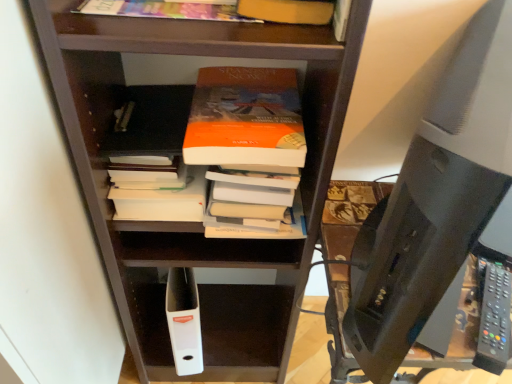
The image size is (512, 384). What do you see at coordinates (154, 121) in the screenshot?
I see `white matte book at center, which is the first book in back-to-front order` at bounding box center [154, 121].

What do you see at coordinates (180, 155) in the screenshot? I see `brown wooden shelf at center` at bounding box center [180, 155].

The image size is (512, 384). I want to click on black plastic desktop computer at right, so click(436, 198).

Is white matte book at center, which appears as the first book when ordered from the bottom, further to camera compared to brown wooden shelf at center?

Yes, the depth of white matte book at center, which appears as the first book when ordered from the bottom, is greater than that of brown wooden shelf at center.

Which is further, (129,145) or (163,247)?

The point (163,247) is farther.

From a real-world perspective, is white matte book at center, which is the first book in back-to-front order, over brown wooden shelf at center?

Yes, from a real-world perspective, white matte book at center, which is the first book in back-to-front order, is on top of brown wooden shelf at center.

From a real-world perspective, count 1st books upward from the brown wooden shelf at center and point to it. Please provide its 2D coordinates.

[(154, 121)]

Considering the points (169, 122) and (486, 368), which point is behind, point (169, 122) or point (486, 368)?

The point (169, 122) is farther from the camera.

Between brown wooden shelf at center and black plastic remote at lower right, which one has larger size?

With larger size is brown wooden shelf at center.

Measure the distance from brown wooden shelf at center to black plastic remote at lower right.

23.81 inches.

Does brown wooden shelf at center appear on the right side of black plastic remote at lower right?

No.

Which is in front, point (287, 10) or point (442, 84)?

The point (442, 84) is closer.

Considering the relative sizes of matte orange book at upper center, the second book positioned from the top, and black plastic desktop computer at right in the image provided, is matte orange book at upper center, the second book positioned from the top, shorter than black plastic desktop computer at right?

Correct, matte orange book at upper center, the second book positioned from the top, is not as tall as black plastic desktop computer at right.

Could you tell me if black plastic remote at lower right is turned towards matte orange book at upper center, which is the second book in front-to-back order?

No, black plastic remote at lower right is not turned towards matte orange book at upper center, which is the second book in front-to-back order.

From the image's perspective, is black plastic remote at lower right above or below matte orange book at upper center, which is the second book in front-to-back order?

black plastic remote at lower right is situated lower than matte orange book at upper center, which is the second book in front-to-back order, in the image.

What's the angular difference between black plastic remote at lower right and matte orange book at upper center, which appears as the second book when ordered from the bottom,'s facing directions?

They differ by 63.3 degrees in their facing directions.

From a real-world perspective, does black plastic remote at lower right sit lower than matte orange book at upper center, which appears as the second book when ordered from the bottom?

Yes, from a real-world perspective, black plastic remote at lower right is below matte orange book at upper center, which appears as the second book when ordered from the bottom.

Is multicolored paper at upper center, the first book when ordered from front to back, further to the viewer compared to black plastic desktop computer at right?

Yes, it is.

In the scene shown: Does multicolored paper at upper center, placed as the 1th book when sorted from top to bottom, turn towards black plastic desktop computer at right?

No, multicolored paper at upper center, placed as the 1th book when sorted from top to bottom, does not turn towards black plastic desktop computer at right.

From a real-world perspective, who is located higher, multicolored paper at upper center, positioned as the third book in bottom-to-top order, or black plastic desktop computer at right?

multicolored paper at upper center, positioned as the third book in bottom-to-top order.

Considering the positions of objects multicolored paper at upper center, placed as the 1th book when sorted from top to bottom, and black plastic desktop computer at right in the image provided, who is more to the right, multicolored paper at upper center, placed as the 1th book when sorted from top to bottom, or black plastic desktop computer at right?

Positioned to the right is black plastic desktop computer at right.

Is there a large distance between black plastic remote at lower right and multicolored paper at upper center, the first book when ordered from front to back?

black plastic remote at lower right is actually quite close to multicolored paper at upper center, the first book when ordered from front to back.

Identify the location of the 2nd book in front of the black plastic remote at lower right. (163, 10).

Can you confirm if black plastic remote at lower right is shorter than multicolored paper at upper center, the first book when ordered from front to back?

Correct, black plastic remote at lower right is not as tall as multicolored paper at upper center, the first book when ordered from front to back.

Is black plastic remote at lower right bigger than multicolored paper at upper center, positioned as the third book in bottom-to-top order?

No.

Considering the sizes of objects white matte book at center, which is the first book in back-to-front order, and black plastic desktop computer at right in the image provided, who is shorter, white matte book at center, which is the first book in back-to-front order, or black plastic desktop computer at right?

white matte book at center, which is the first book in back-to-front order, is shorter.

Is point (133, 121) positioned before point (393, 366)?

No, (133, 121) is behind (393, 366).

Is white matte book at center, which ranks as the third book in top-to-bottom order, smaller than black plastic desktop computer at right?

Yes, white matte book at center, which ranks as the third book in top-to-bottom order, is smaller than black plastic desktop computer at right.

From the image's perspective, between white matte book at center, which is the 3th book in front-to-back order, and black plastic desktop computer at right, who is located below?

white matte book at center, which is the 3th book in front-to-back order.

Starting from the brown wooden shelf at center, which book is the 2nd one behind? Please provide its 2D coordinates.

[(154, 121)]

The height and width of the screenshot is (384, 512). I want to click on remote below the brown wooden shelf at center (from the image's perspective), so click(x=494, y=319).

In the scene shown: Which object lies nearer to the anchor point brown wooden shelf at center, white matte book at center, which appears as the first book when ordered from the bottom, or black plastic remote at lower right?

white matte book at center, which appears as the first book when ordered from the bottom, is positioned closer to the anchor brown wooden shelf at center.

Which object lies nearer to the anchor point matte orange book at upper center, which is the second book in front-to-back order, white matte book at center, which ranks as the third book in top-to-bottom order, or black plastic remote at lower right?

Among the two, white matte book at center, which ranks as the third book in top-to-bottom order, is located nearer to matte orange book at upper center, which is the second book in front-to-back order.

Estimate the real-world distances between objects in this image. Which object is further from matte orange book at upper center, which appears as the second book when ordered from the bottom, brown wooden shelf at center or black plastic desktop computer at right?

brown wooden shelf at center lies further to matte orange book at upper center, which appears as the second book when ordered from the bottom, than the other object.

Which object lies further to the anchor point black plastic desktop computer at right, black plastic remote at lower right or brown wooden shelf at center?

The object further to black plastic desktop computer at right is brown wooden shelf at center.

Looking at the image, which one is located closer to black plastic remote at lower right, black plastic desktop computer at right or matte orange book at upper center, which is the second book in front-to-back order?

black plastic desktop computer at right is closer to black plastic remote at lower right.

From the picture: Based on their spatial positions, is multicolored paper at upper center, the first book when ordered from front to back, or white matte book at center, which is the 3th book in front-to-back order, closer to black plastic remote at lower right?

Based on the image, white matte book at center, which is the 3th book in front-to-back order, appears to be nearer to black plastic remote at lower right.

Based on their spatial positions, is matte orange book at upper center, which appears as the second book when viewed from the back, or black plastic remote at lower right further from multicolored paper at upper center, positioned as the third book in bottom-to-top order?

black plastic remote at lower right.

Considering their positions, is black plastic desktop computer at right positioned closer to brown wooden shelf at center than matte orange book at upper center, the second book positioned from the top?

black plastic desktop computer at right.

In order to click on shelf between white matte book at center, which appears as the first book when ordered from the bottom, and black plastic remote at lower right, in the horizontal direction in this screenshot , I will do `click(180, 155)`.

At what (x,y) coordinates should I click in order to perform the action: click on shelf located between black plastic desktop computer at right and white matte book at center, which appears as the first book when ordered from the bottom, in the depth direction. Please return your answer as a coordinate pair (x, y). This screenshot has height=384, width=512. Looking at the image, I should click on (180, 155).

In order to click on book located between brown wooden shelf at center and black plastic remote at lower right in the left-right direction in this screenshot , I will do `click(288, 11)`.

At what (x,y) coordinates should I click in order to perform the action: click on shelf positioned between multicolored paper at upper center, positioned as the third book in bottom-to-top order, and white matte book at center, which is the 3th book in front-to-back order, from near to far. Please return your answer as a coordinate pair (x, y). This screenshot has height=384, width=512. Looking at the image, I should click on (180, 155).